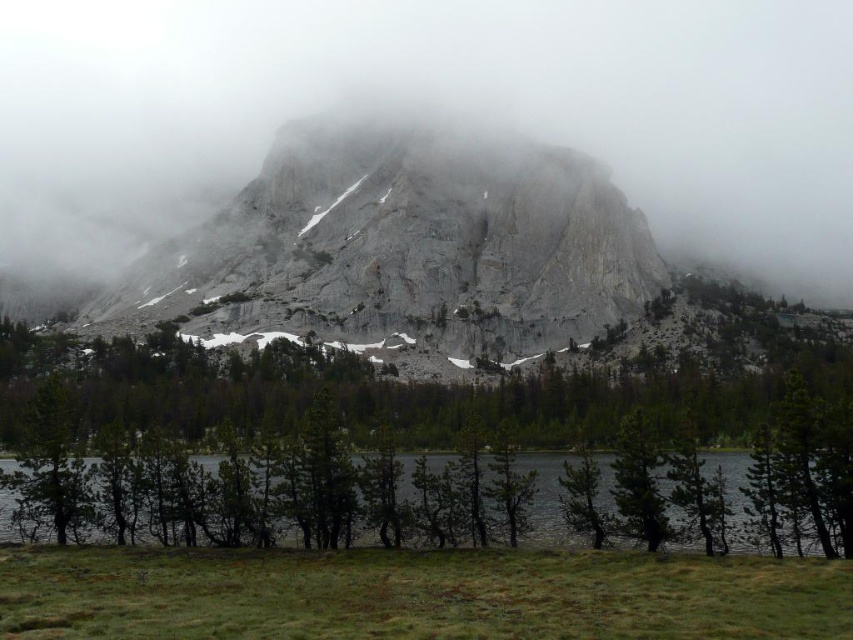
You are standing at the point marked by the coordinates point [401,252]. Looking around, you see the gray rock mountain at center. Which direction should you walk to reach the base of the gray rock mountain at center?

Since the point [401,252] is the location of the gray rock mountain at center, you are already at its base. There is no need to move further.

You are standing on the edge of the green matte water at lower center and want to reach the gray rock mountain at center. Which direction should you face to see the mountain directly in front of you?

You should face to the right because the gray rock mountain at center is located to the left of the green matte water at lower center. Facing right from the water will have the mountain directly in front of you.